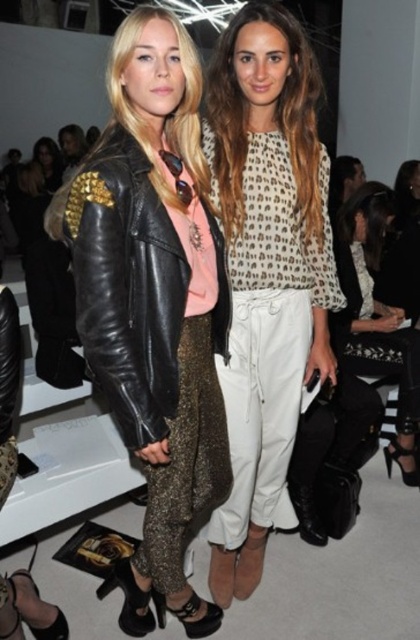
Can you confirm if shiny black leather jacket at center is smaller than white textured pants at center?

No, shiny black leather jacket at center is not smaller than white textured pants at center.

Consider the image. Who is lower down, shiny black leather jacket at center or white textured pants at center?

shiny black leather jacket at center is lower down.

Which is behind, point (139, 58) or point (398, 362)?

The point (398, 362) is more distant.

The image size is (420, 640). I want to click on shiny black leather jacket at center, so click(x=154, y=301).

Between shiny black leather jacket at center and printed fabric blouse at center, which one appears on the left side from the viewer's perspective?

Positioned to the left is shiny black leather jacket at center.

This screenshot has width=420, height=640. What do you see at coordinates (154, 301) in the screenshot?
I see `shiny black leather jacket at center` at bounding box center [154, 301].

At what (x,y) coordinates should I click in order to perform the action: click on shiny black leather jacket at center. Please return your answer as a coordinate pair (x, y). The image size is (420, 640). Looking at the image, I should click on (154, 301).

At what (x,y) coordinates should I click in order to perform the action: click on printed fabric blouse at center. Please return your answer as a coordinate pair (x, y). The image size is (420, 640). Looking at the image, I should click on (265, 268).

This screenshot has width=420, height=640. I want to click on printed fabric blouse at center, so click(265, 268).